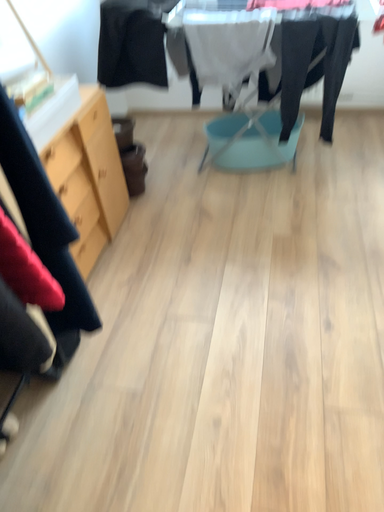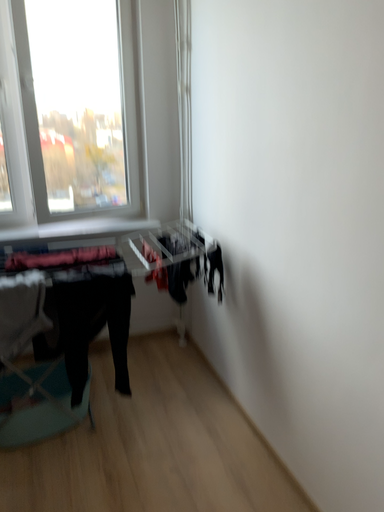
Question: How did the camera likely rotate when shooting the video?

Choices:
 (A) rotated downward
 (B) rotated upward

Answer: (B)